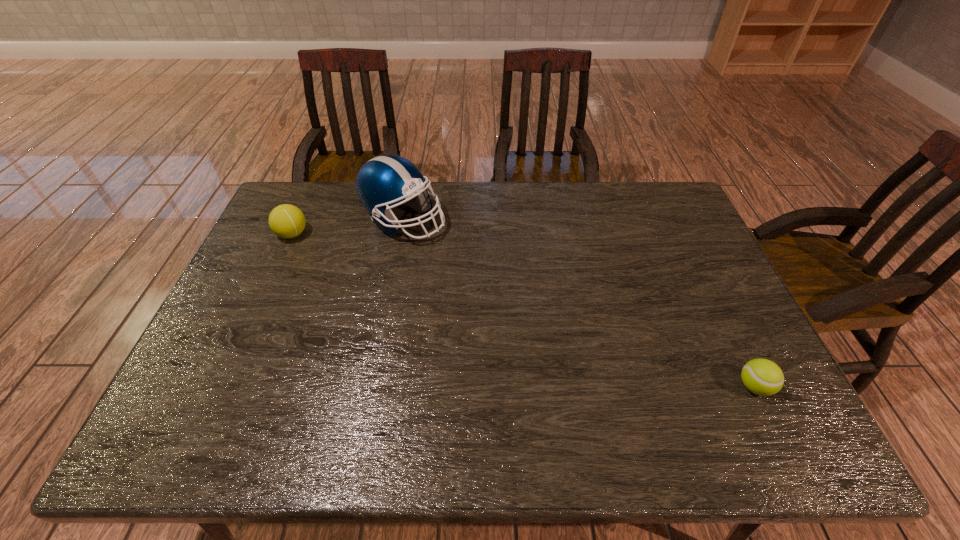
Where is `vacant space that satisfies the following two spatial constraints: 1. at the front of the football helmet with the faceguard; 2. on the left side of the shortest object`? vacant space that satisfies the following two spatial constraints: 1. at the front of the football helmet with the faceguard; 2. on the left side of the shortest object is located at coordinates (372, 387).

Identify the location of vacant space that satisfies the following two spatial constraints: 1. at the front of the nearest object with the faceguard; 2. on the left side of the football helmet. The height and width of the screenshot is (540, 960). (372, 387).

The width and height of the screenshot is (960, 540). I want to click on vacant region that satisfies the following two spatial constraints: 1. at the front of the second object from left to right with the faceguard; 2. on the back side of the nearer tennis ball, so click(x=372, y=387).

Image resolution: width=960 pixels, height=540 pixels. I want to click on free space that satisfies the following two spatial constraints: 1. at the front of the right tennis ball with the faceguard; 2. on the left side of the football helmet, so click(372, 387).

You are a GUI agent. You are given a task and a screenshot of the screen. Output one action in this format:
    pyautogui.click(x=<x>, y=<y>)
    Task: Click on the free location that satisfies the following two spatial constraints: 1. at the front of the football helmet with the faceguard; 2. on the back side of the nearer tennis ball
    The image size is (960, 540).
    Given the screenshot: What is the action you would take?
    pyautogui.click(x=372, y=387)

Where is `free region that satisfies the following two spatial constraints: 1. at the front of the tallest object with the faceguard; 2. on the front side of the farther tennis ball`? This screenshot has width=960, height=540. free region that satisfies the following two spatial constraints: 1. at the front of the tallest object with the faceguard; 2. on the front side of the farther tennis ball is located at coordinates (400, 234).

The width and height of the screenshot is (960, 540). I want to click on free region that satisfies the following two spatial constraints: 1. at the front of the shortest object with the faceguard; 2. on the right side of the football helmet, so click(372, 387).